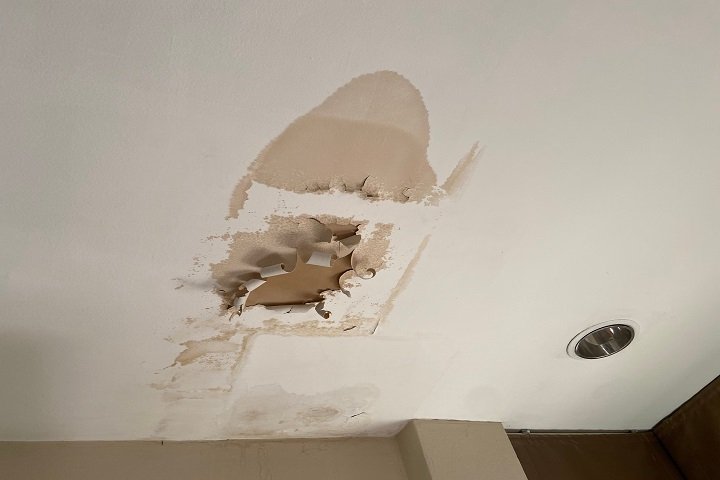
Where is `portion of ceiling that meets wall under pot light`? The width and height of the screenshot is (720, 480). portion of ceiling that meets wall under pot light is located at coordinates (590, 430).